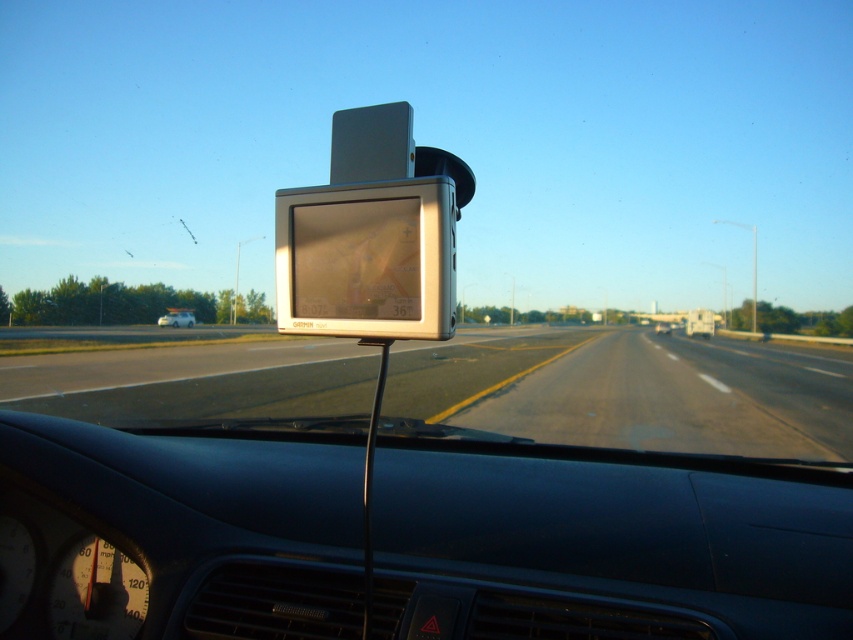
Is point (253, 403) farther from viewer compared to point (177, 317)?

No, it is in front of (177, 317).

Is point (659, 417) positioned before point (184, 321)?

Yes, it is in front of point (184, 321).

Is point (276, 372) closer to camera compared to point (175, 307)?

Yes, point (276, 372) is in front of point (175, 307).

This screenshot has height=640, width=853. I want to click on smooth asphalt highway at center, so click(633, 392).